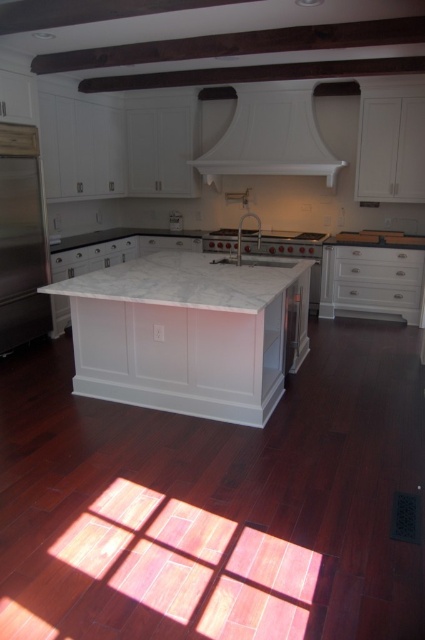
Question: Which point is closer to the camera?

Choices:
 (A) white matte exhaust hood at upper center
 (B) white marble countertop at center
 (C) stainless steel refrigerator at left

Answer: (B)

Question: Is white matte exhaust hood at upper center above stainless steel refrigerator at left?

Choices:
 (A) no
 (B) yes

Answer: (B)

Question: Which is farther from the white matte exhaust hood at upper center?

Choices:
 (A) stainless steel refrigerator at left
 (B) white marble countertop at center

Answer: (A)

Question: Is white matte exhaust hood at upper center above stainless steel refrigerator at left?

Choices:
 (A) yes
 (B) no

Answer: (A)

Question: Based on their relative distances, which object is nearer to the stainless steel refrigerator at left?

Choices:
 (A) white marble countertop at center
 (B) white matte exhaust hood at upper center

Answer: (A)

Question: Is white marble countertop at center below stainless steel refrigerator at left?

Choices:
 (A) no
 (B) yes

Answer: (B)